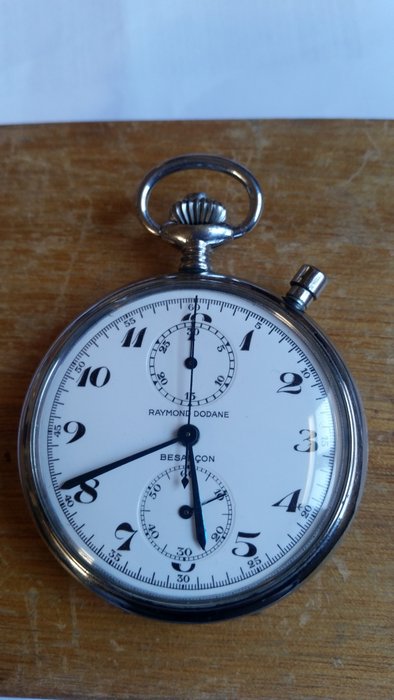
Identify the location of two smaller clock faces. This screenshot has width=394, height=700. (169, 514), (177, 358).